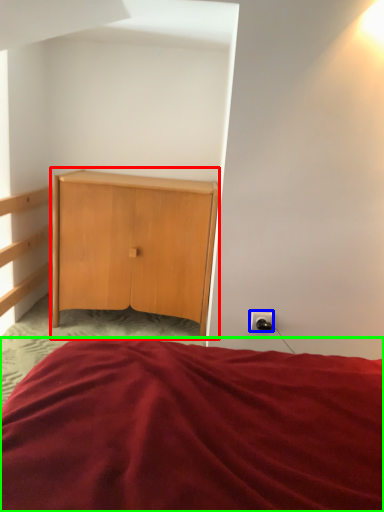
Question: Based on their relative distances, which object is farther from nightstand (highlighted by a red box)? Choose from electric outlet (highlighted by a blue box) and bed (highlighted by a green box).

Choices:
 (A) electric outlet
 (B) bed

Answer: (B)